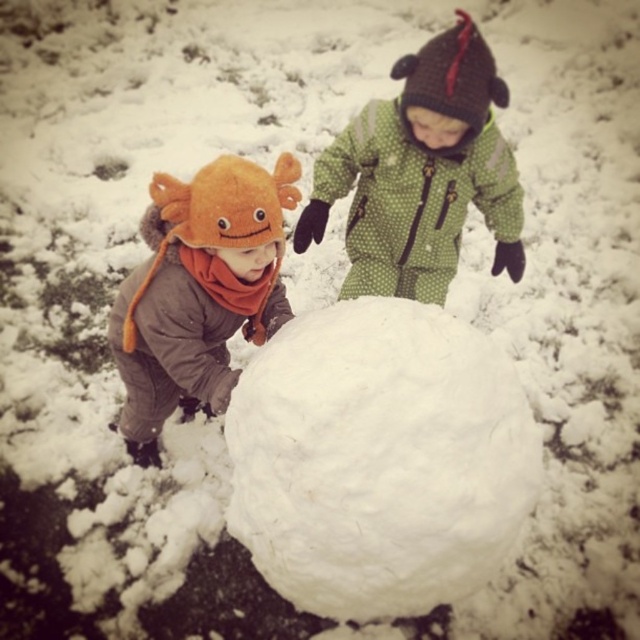
In the scene shown: You are a photographer trying to capture a photo of the white fluffy snowball at center and the orange fuzzy hat at left. If you move closer to the snowball, will the hat still be visible in the frame?

The white fluffy snowball at center is in front of the orange fuzzy hat at left, so if you move closer to the snowball, the hat might be blocked by the snowball and may not be fully visible in the photo.